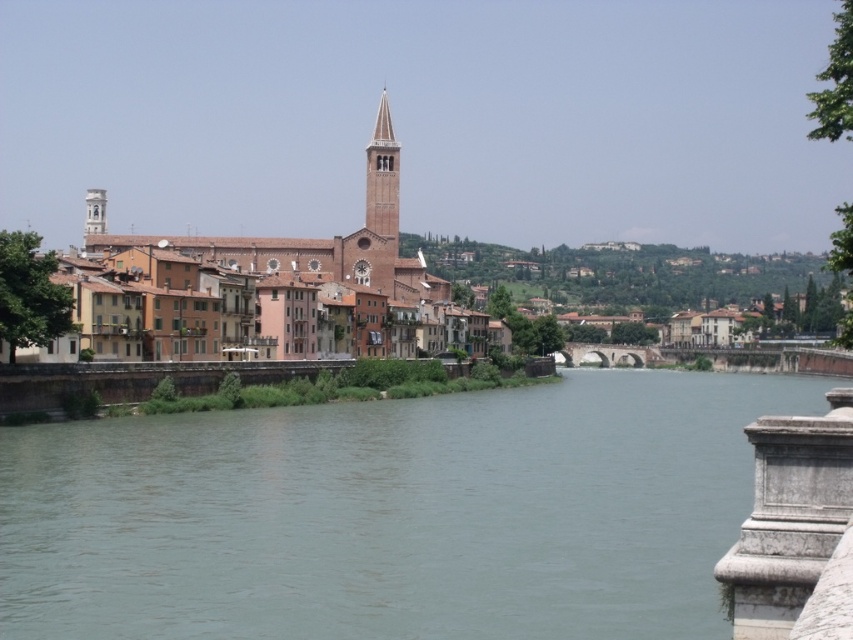
Does greenish concrete river at center have a greater width compared to smooth white tower at upper left?

Indeed, greenish concrete river at center has a greater width compared to smooth white tower at upper left.

How much distance is there between greenish concrete river at center and smooth white tower at upper left?

greenish concrete river at center and smooth white tower at upper left are 379.33 feet apart.

Is point (90, 627) more distant than point (102, 196)?

No.

I want to click on greenish concrete river at center, so click(392, 513).

Can you confirm if brown brick town at center is positioned to the right of smooth white tower at upper left?

Yes, brown brick town at center is to the right of smooth white tower at upper left.

Is point (268, 257) behind point (96, 227)?

No, (268, 257) is in front of (96, 227).

Image resolution: width=853 pixels, height=640 pixels. What do you see at coordinates (297, 259) in the screenshot?
I see `brown brick town at center` at bounding box center [297, 259].

You are a GUI agent. You are given a task and a screenshot of the screen. Output one action in this format:
    pyautogui.click(x=<x>, y=<y>)
    Task: Click on the brown brick town at center
    The image size is (853, 640).
    Given the screenshot: What is the action you would take?
    pyautogui.click(x=297, y=259)

Who is higher up, brown brick bell tower at center or smooth white tower at upper left?

brown brick bell tower at center is higher up.

Consider the image. Can you confirm if brown brick bell tower at center is thinner than smooth white tower at upper left?

Correct, brown brick bell tower at center's width is less than smooth white tower at upper left's.

Measure the distance between brown brick bell tower at center and camera.

They are 212.09 meters apart.

Find the location of a particular element. The width and height of the screenshot is (853, 640). brown brick bell tower at center is located at coordinates (381, 177).